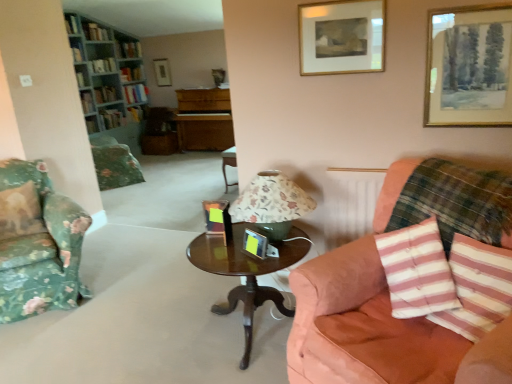
This screenshot has height=384, width=512. In order to click on vacant space positioned to the left of dark wood coffee table at center in this screenshot , I will do `click(165, 322)`.